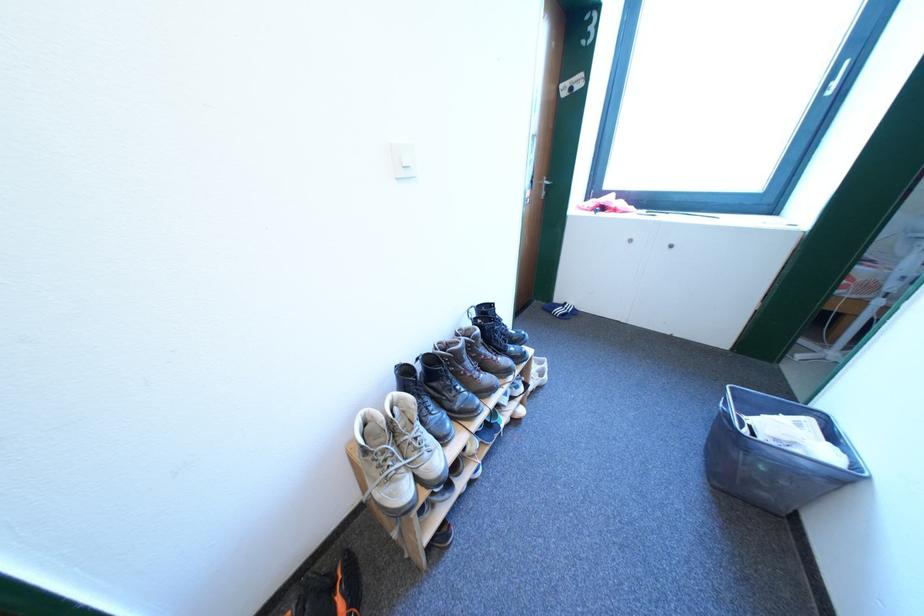
Describe the element at coordinates (836, 78) in the screenshot. This screenshot has width=924, height=616. I see `the window handle` at that location.